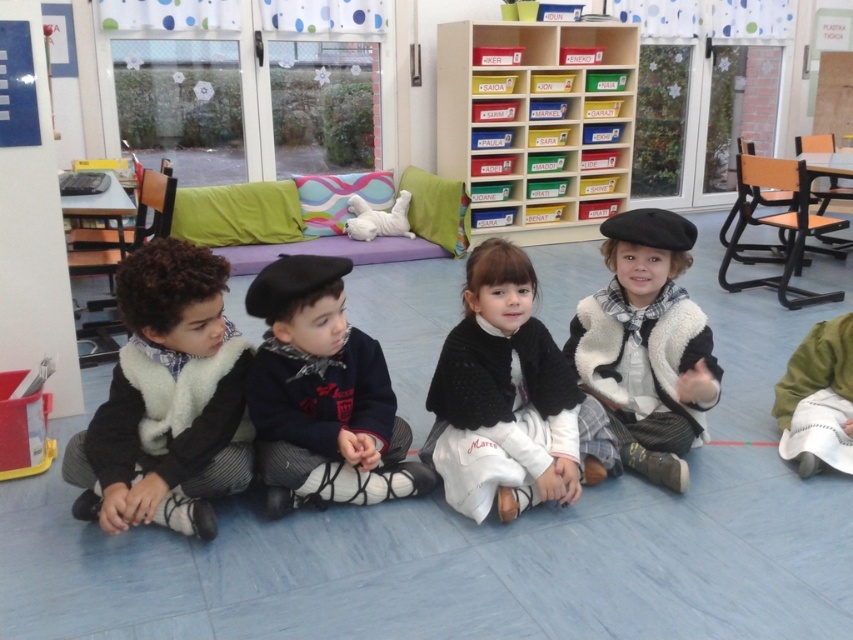
Question: Which point is farther from the camera taking this photo?

Choices:
 (A) (364, 362)
 (B) (480, 326)
 (C) (170, 397)

Answer: (A)

Question: Can you confirm if velvet black vest at left is wider than white fuzzy coat at center?

Choices:
 (A) yes
 (B) no

Answer: (A)

Question: Which object appears farthest from the camera in this image?

Choices:
 (A) matte black beret at center
 (B) fuzzy white coat at center
 (C) velvet black vest at left

Answer: (B)

Question: Considering the relative positions of matte black beret at center and fuzzy white coat at center in the image provided, where is matte black beret at center located with respect to fuzzy white coat at center?

Choices:
 (A) below
 (B) above

Answer: (A)

Question: Is matte black beret at center wider than fuzzy white coat at center?

Choices:
 (A) yes
 (B) no

Answer: (A)

Question: Estimate the real-world distances between objects in this image. Which object is farther from the matte black beret at center?

Choices:
 (A) velvet black vest at left
 (B) fuzzy white coat at center

Answer: (B)